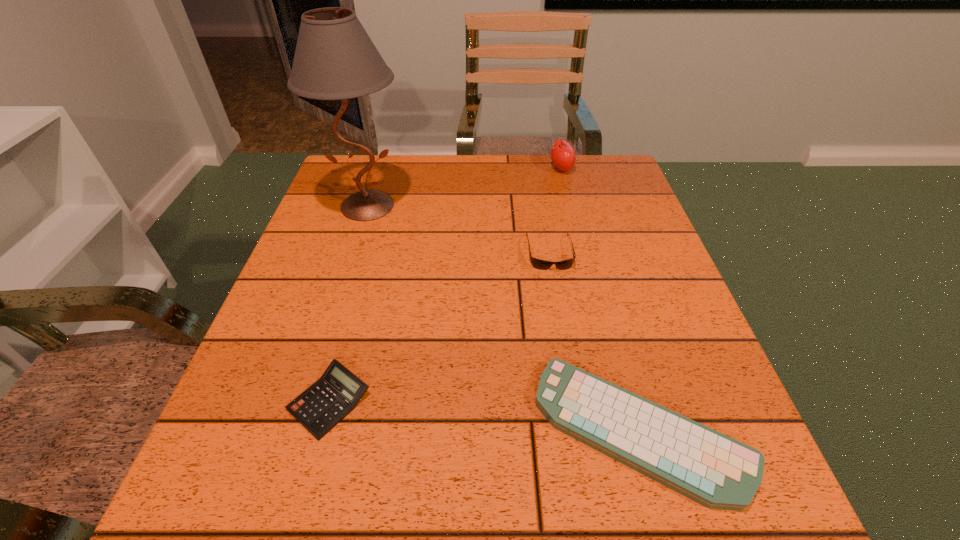
At what (x,y) coordinates should I click in order to perform the action: click on object at the far right corner. Please return your answer as a coordinate pair (x, y). The image size is (960, 540). Looking at the image, I should click on (563, 156).

Find the location of `object that is at the near right corner`. object that is at the near right corner is located at coordinates (714, 470).

Identify the location of free space at the far edge of the desktop. The width and height of the screenshot is (960, 540). (540, 159).

The width and height of the screenshot is (960, 540). In order to click on vacant space at the near edge of the desktop in this screenshot , I will do `click(379, 483)`.

Find the location of a particular element. The height and width of the screenshot is (540, 960). blank space at the left edge is located at coordinates 343,217.

Image resolution: width=960 pixels, height=540 pixels. What are the coordinates of `free spot at the right edge of the desktop` in the screenshot? It's located at (661, 403).

Where is `blank space at the far left corner`? This screenshot has width=960, height=540. blank space at the far left corner is located at coordinates (378, 173).

The height and width of the screenshot is (540, 960). I want to click on free space between the calculator and the third nearest object, so click(x=440, y=327).

The width and height of the screenshot is (960, 540). I want to click on free space between the sunglasses and the computer keyboard, so click(595, 340).

Locate an element on the screen. This screenshot has width=960, height=540. vacant space that's between the sunglasses and the computer keyboard is located at coordinates (595, 340).